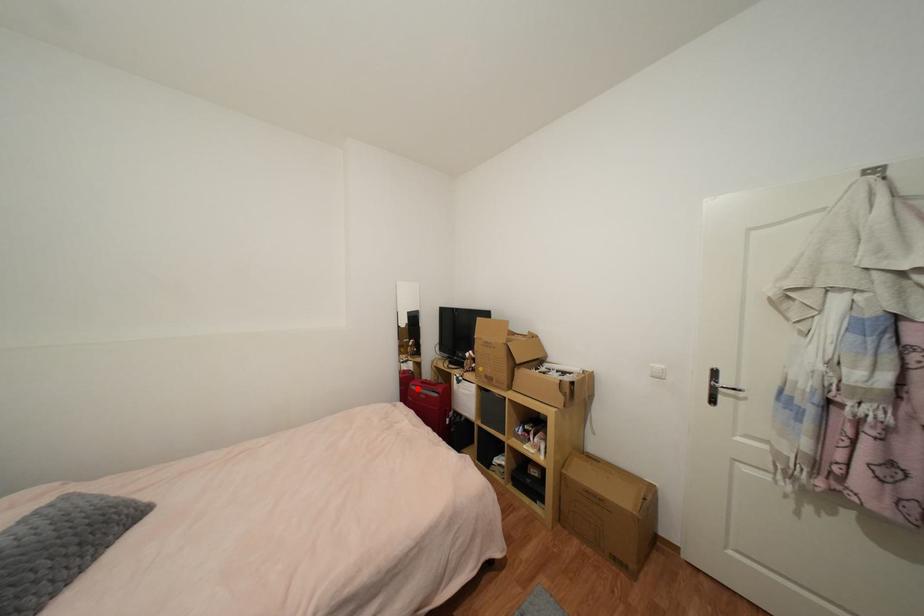
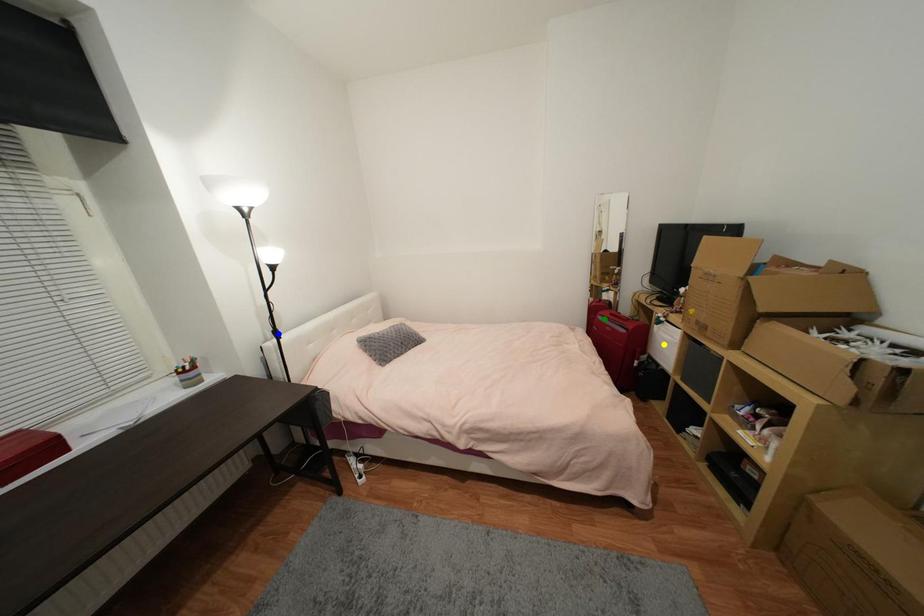
Question: I am providing you with two images of the same scene from different viewpoints. A red point is marked on the first image. You are given multiple points on the second image. Which point in image 2 represents the same 3d spot as the red point in image 1?

Choices:
 (A) blue point
 (B) yellow point
 (C) green point

Answer: (C)